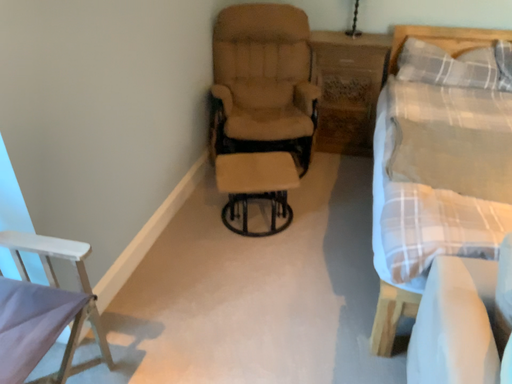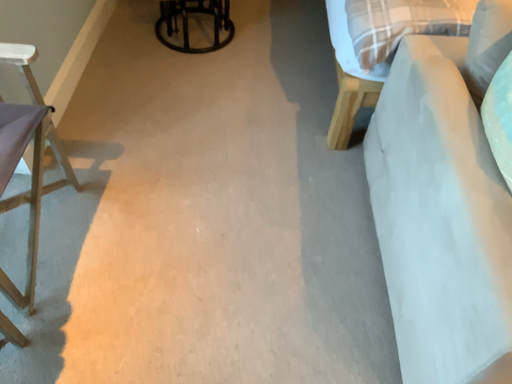
Question: Which way did the camera rotate in the video?

Choices:
 (A) rotated right
 (B) rotated left

Answer: (A)